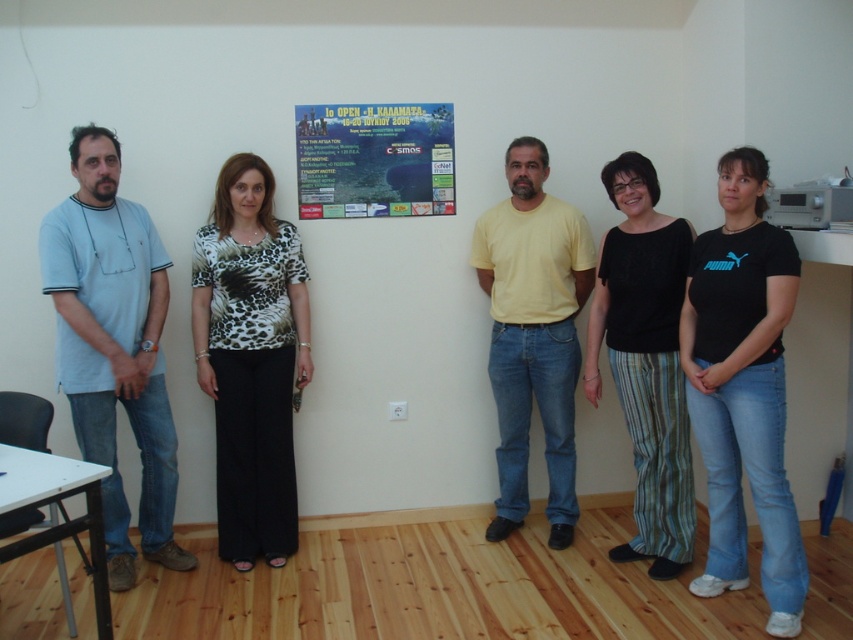
You are standing in the room and want to move from the point at coordinates point (552, 432) to the point at coordinates point (317, 131). Which direction should you move in to get closer to your destination?

To move from point (552, 432) to point (317, 131), you should move towards the left and downward since point (317, 131) is located to the left and lower than point (552, 432).